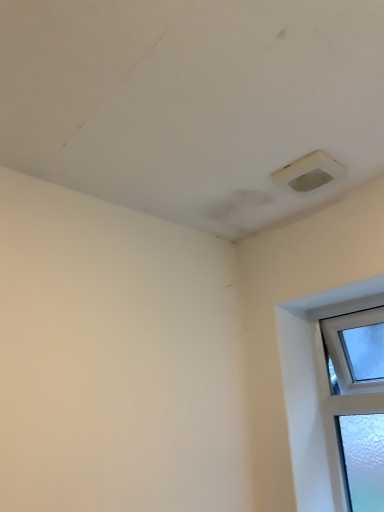
In order to face clear glass window at lower right, should I rotate leftwards or rightwards?

A 22.094 degree turn to the right will do.

Describe the element at coordinates (319, 391) in the screenshot. This screenshot has height=512, width=384. I see `clear glass window at lower right` at that location.

Where is `clear glass window at lower right`? clear glass window at lower right is located at coordinates click(319, 391).

Where is `white plastic air conditioning at upper right`? Image resolution: width=384 pixels, height=512 pixels. white plastic air conditioning at upper right is located at coordinates (310, 173).

Describe the element at coordinates (310, 173) in the screenshot. I see `white plastic air conditioning at upper right` at that location.

At what (x,y) coordinates should I click in order to perform the action: click on clear glass window at lower right. Please return your answer as a coordinate pair (x, y). Looking at the image, I should click on (319, 391).

Which object is positioned more to the right, white plastic air conditioning at upper right or clear glass window at lower right?

clear glass window at lower right.

Relative to clear glass window at lower right, is white plastic air conditioning at upper right in front or behind?

white plastic air conditioning at upper right is in front of clear glass window at lower right.

Between point (318, 168) and point (342, 393), which one is positioned in front?

Positioned in front is point (318, 168).

From the image's perspective, which one is positioned higher, white plastic air conditioning at upper right or clear glass window at lower right?

From the image's view, white plastic air conditioning at upper right is above.

From a real-world perspective, is white plastic air conditioning at upper right beneath clear glass window at lower right?

Actually, white plastic air conditioning at upper right is physically above clear glass window at lower right in the real world.

Based on the photo, between white plastic air conditioning at upper right and clear glass window at lower right, which one has larger width?

white plastic air conditioning at upper right is wider.

In terms of height, does white plastic air conditioning at upper right look taller or shorter compared to clear glass window at lower right?

Considering their sizes, white plastic air conditioning at upper right has less height than clear glass window at lower right.

Who is bigger, white plastic air conditioning at upper right or clear glass window at lower right?

With larger size is clear glass window at lower right.

Which is correct: white plastic air conditioning at upper right is inside clear glass window at lower right, or outside of it?

white plastic air conditioning at upper right is not inside clear glass window at lower right, it's outside.

Are white plastic air conditioning at upper right and clear glass window at lower right far apart?

No, there isn't a large distance between white plastic air conditioning at upper right and clear glass window at lower right.

Is white plastic air conditioning at upper right looking in the opposite direction of clear glass window at lower right?

white plastic air conditioning at upper right does not have its back to clear glass window at lower right.

In the image, there is a white plastic air conditioning at upper right. At what (x,y) coordinates should I click in order to perform the action: click on window below it (from a real-world perspective). Please return your answer as a coordinate pair (x, y). Looking at the image, I should click on (319, 391).

Which is more to the left, clear glass window at lower right or white plastic air conditioning at upper right?

white plastic air conditioning at upper right is more to the left.

Which is in front, clear glass window at lower right or white plastic air conditioning at upper right?

white plastic air conditioning at upper right.

Is point (299, 384) closer to camera compared to point (301, 181)?

No, it is not.

From the image's perspective, is clear glass window at lower right on top of white plastic air conditioning at upper right?

No, from the image's perspective, clear glass window at lower right is not on top of white plastic air conditioning at upper right.

From a real-world perspective, is clear glass window at lower right on top of white plastic air conditioning at upper right?

No, from a real-world perspective, clear glass window at lower right is not above white plastic air conditioning at upper right.

Which of these two, clear glass window at lower right or white plastic air conditioning at upper right, is wider?

white plastic air conditioning at upper right.

Does clear glass window at lower right have a lesser height compared to white plastic air conditioning at upper right?

No.

Does clear glass window at lower right have a smaller size compared to white plastic air conditioning at upper right?

Actually, clear glass window at lower right might be larger than white plastic air conditioning at upper right.

Is clear glass window at lower right situated inside white plastic air conditioning at upper right or outside?

clear glass window at lower right is located beyond the bounds of white plastic air conditioning at upper right.

Is clear glass window at lower right not near white plastic air conditioning at upper right?

clear glass window at lower right is actually quite close to white plastic air conditioning at upper right.

Is white plastic air conditioning at upper right at the back of clear glass window at lower right?

No, clear glass window at lower right is not facing the opposite direction of white plastic air conditioning at upper right.

This screenshot has height=512, width=384. In order to click on air conditioning in front of the clear glass window at lower right in this screenshot , I will do [310, 173].

This screenshot has width=384, height=512. I want to click on air conditioning above the clear glass window at lower right (from the image's perspective), so click(x=310, y=173).

You are a GUI agent. You are given a task and a screenshot of the screen. Output one action in this format:
    pyautogui.click(x=<x>, y=<y>)
    Task: Click on the window below the white plastic air conditioning at upper right (from the image's perspective)
    
    Given the screenshot: What is the action you would take?
    pyautogui.click(x=319, y=391)